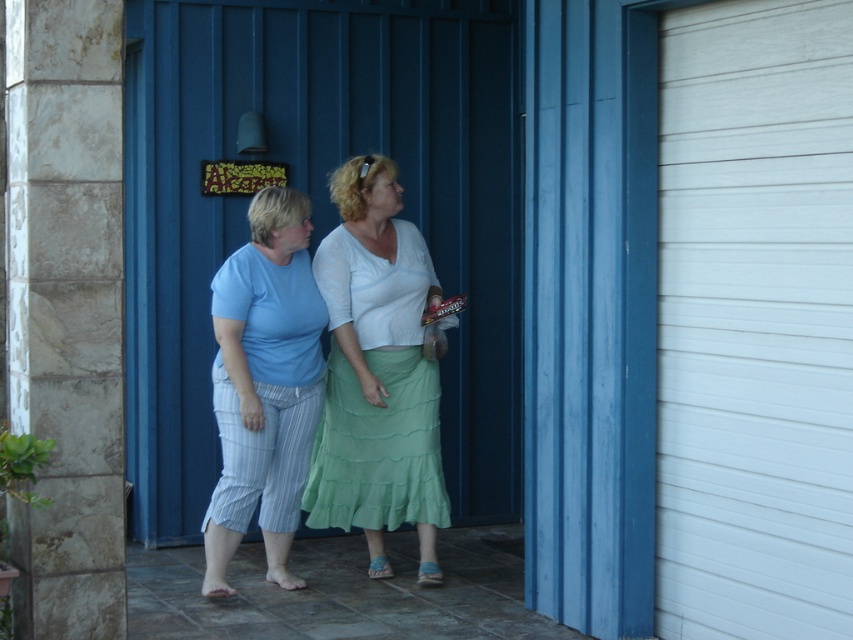
You are a delivery person who needs to find the blue metal door at center. You are currently standing at point (x=318, y=209). Which direction should you go to reach the blue metal door at center?

The blue metal door at center is located at point (x=318, y=209), so you are already at the correct location.